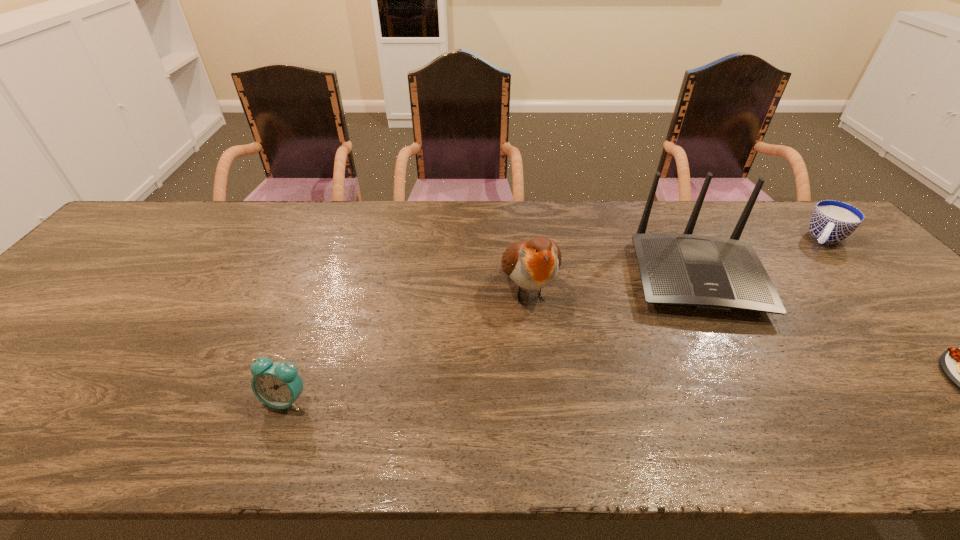
Where is `the third shortest object`? The height and width of the screenshot is (540, 960). the third shortest object is located at coordinates (278, 385).

Where is `alarm clock`? The image size is (960, 540). alarm clock is located at coordinates (278, 385).

Locate an element on the screen. router is located at coordinates (707, 273).

The width and height of the screenshot is (960, 540). I want to click on the second object from left to right, so click(x=533, y=264).

Find the location of a particular element. cup is located at coordinates (832, 221).

At what (x,y) coordinates should I click in order to perform the action: click on vacant position located 0.050m on the front-facing side of the third object from left to right. Please return your answer as a coordinate pair (x, y). Looking at the image, I should click on (716, 340).

Locate an element on the screen. This screenshot has height=540, width=960. vacant space located 0.170m on the front-facing side of the third object from left to right is located at coordinates (732, 382).

Locate an element on the screen. Image resolution: width=960 pixels, height=540 pixels. free space located 0.130m on the front-facing side of the third object from left to right is located at coordinates (727, 367).

Image resolution: width=960 pixels, height=540 pixels. What are the coordinates of `free space located 0.160m at the face of the bird` in the screenshot? It's located at (555, 381).

Find the location of a particular element. The width and height of the screenshot is (960, 540). free location located 0.120m at the face of the bird is located at coordinates (550, 366).